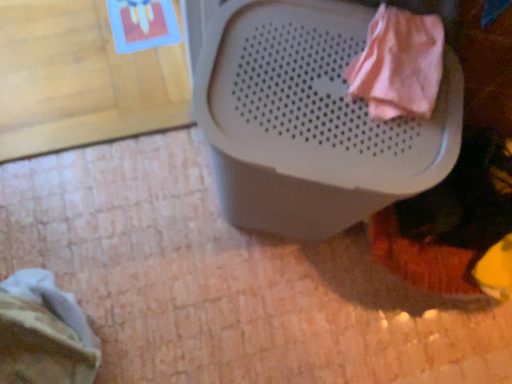
At what (x,y) coordinates should I click in order to perform the action: click on spots to the right of striped fabric at lower left, which is the second clothing from right to left. Please return your answer as a coordinate pair (x, y). This screenshot has width=512, height=384. Looking at the image, I should click on pyautogui.click(x=159, y=342).